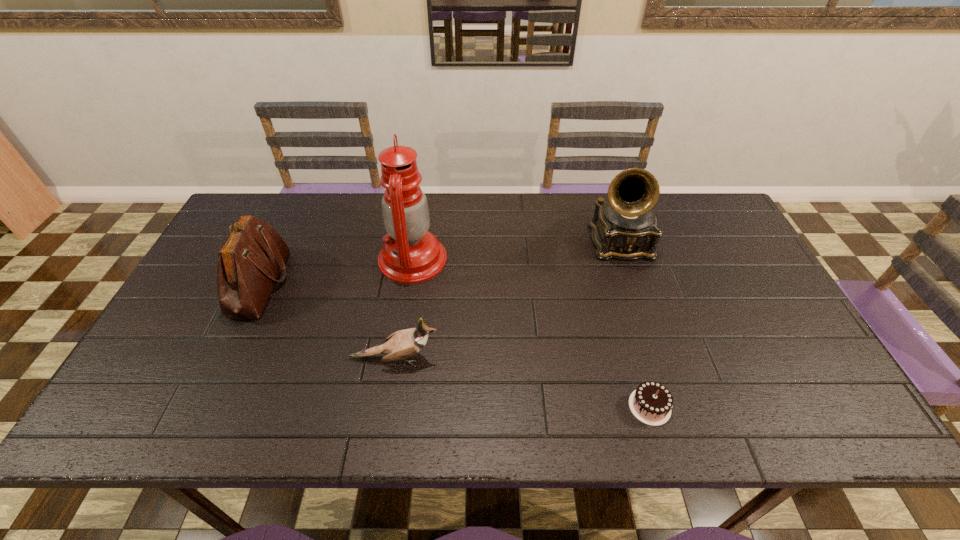
Locate an element on the screen. The image size is (960, 540). vacant area between the chocolate cake and the tallest object is located at coordinates (531, 333).

Image resolution: width=960 pixels, height=540 pixels. Find the location of `vacant area that lies between the oil lamp and the leftmost object`. vacant area that lies between the oil lamp and the leftmost object is located at coordinates tap(337, 271).

The width and height of the screenshot is (960, 540). Identify the location of free spot between the chocolate cake and the third tallest object. (455, 345).

I want to click on vacant space that is in between the fourth tallest object and the tallest object, so click(403, 309).

Locate an element on the screen. The height and width of the screenshot is (540, 960). empty space that is in between the shortest object and the fourth shortest object is located at coordinates (635, 325).

In order to click on vacant space that is in between the oil lamp and the second nearest object in this screenshot , I will do `click(403, 309)`.

What are the coordinates of `empty location between the tallest object and the shoulder bag` in the screenshot? It's located at (337, 271).

I want to click on free space between the tallest object and the chocolate cake, so click(531, 333).

I want to click on empty space that is in between the fourth shortest object and the oil lamp, so [x=516, y=251].

This screenshot has width=960, height=540. Identify the location of free space between the shortest object and the fourth tallest object. (522, 382).